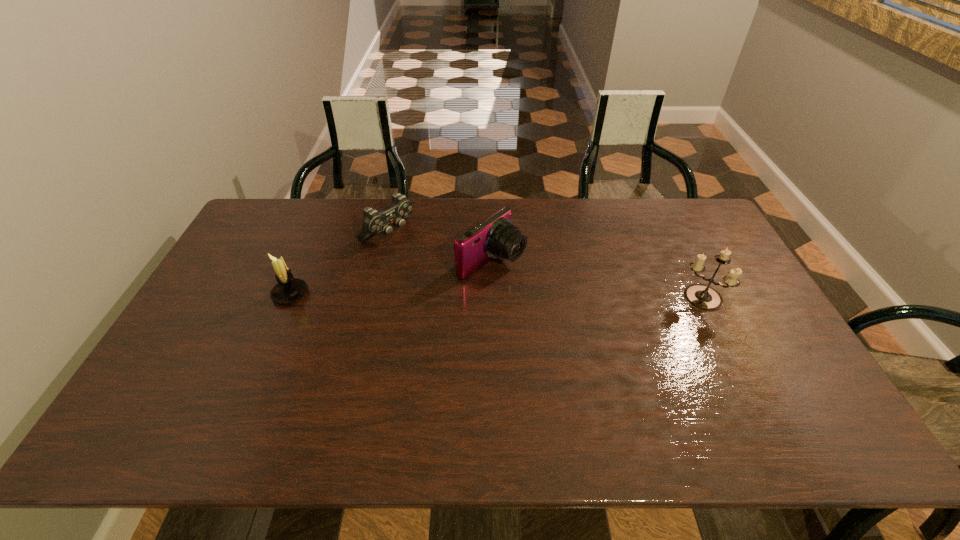
Select which object appears as the second closest to the second object from right to left. Please provide its 2D coordinates. Your answer should be formatted as a tuple, i.e. [(x, y)], where the tuple contains the x and y coordinates of a point satisfying the conditions above.

[(288, 290)]

Locate an element on the screen. The image size is (960, 540). object that is the third nearest to the right candle holder is located at coordinates (288, 290).

The image size is (960, 540). Identify the location of vacant space that satisfies the following two spatial constraints: 1. on the back side of the leftmost object; 2. on the left side of the second object from left to right. (317, 232).

Where is `vacant space that satisfies the following two spatial constraints: 1. on the front side of the third object from left to right; 2. on the left side of the control`? This screenshot has width=960, height=540. vacant space that satisfies the following two spatial constraints: 1. on the front side of the third object from left to right; 2. on the left side of the control is located at coordinates (381, 261).

The width and height of the screenshot is (960, 540). Identify the location of free space in the image that satisfies the following two spatial constraints: 1. on the front side of the second object from left to right; 2. on the right side of the right candle holder. (372, 298).

Locate an element on the screen. The width and height of the screenshot is (960, 540). free point that satisfies the following two spatial constraints: 1. on the back side of the leftmost object; 2. on the right side of the camera is located at coordinates (304, 261).